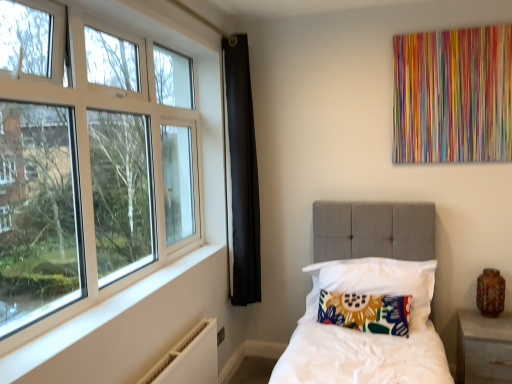
Question: Could you tell me if matte gray nightstand at lower right is turned towards white textured radiator at lower left?

Choices:
 (A) yes
 (B) no

Answer: (B)

Question: From the image's perspective, is matte gray nightstand at lower right located beneath white textured radiator at lower left?

Choices:
 (A) yes
 (B) no

Answer: (A)

Question: From a real-world perspective, is matte gray nightstand at lower right over white textured radiator at lower left?

Choices:
 (A) yes
 (B) no

Answer: (B)

Question: From the image's perspective, is matte gray nightstand at lower right above white textured radiator at lower left?

Choices:
 (A) no
 (B) yes

Answer: (A)

Question: Is matte gray nightstand at lower right facing away from white textured radiator at lower left?

Choices:
 (A) yes
 (B) no

Answer: (B)

Question: Is matte gray nightstand at lower right not near white textured radiator at lower left?

Choices:
 (A) yes
 (B) no

Answer: (A)

Question: Is floral fabric pillow at center, marked as the 2th pillow in a bottom-to-top arrangement, outside floral fabric pillow at center, which appears as the 1th pillow when ordered from the bottom?

Choices:
 (A) yes
 (B) no

Answer: (A)

Question: Is the position of floral fabric pillow at center, the 1th pillow viewed from the top, more distant than that of floral fabric pillow at center, which appears as the 1th pillow when ordered from the bottom?

Choices:
 (A) no
 (B) yes

Answer: (B)

Question: From the image's perspective, is floral fabric pillow at center, the 1th pillow viewed from the top, above floral fabric pillow at center, which appears as the 1th pillow when ordered from the bottom?

Choices:
 (A) no
 (B) yes

Answer: (B)

Question: Is floral fabric pillow at center, the 1th pillow viewed from the top, facing away from floral fabric pillow at center, which appears as the 1th pillow when ordered from the bottom?

Choices:
 (A) yes
 (B) no

Answer: (A)

Question: Is the position of floral fabric pillow at center, marked as the 2th pillow in a bottom-to-top arrangement, less distant than that of floral fabric pillow at center, which appears as the 1th pillow when ordered from the bottom?

Choices:
 (A) no
 (B) yes

Answer: (A)

Question: Is floral fabric pillow at center, the second pillow viewed from the top, surrounded by floral fabric pillow at center, the 1th pillow viewed from the top?

Choices:
 (A) yes
 (B) no

Answer: (A)

Question: From a real-world perspective, is white textured radiator at lower left located higher than matte gray nightstand at lower right?

Choices:
 (A) no
 (B) yes

Answer: (B)